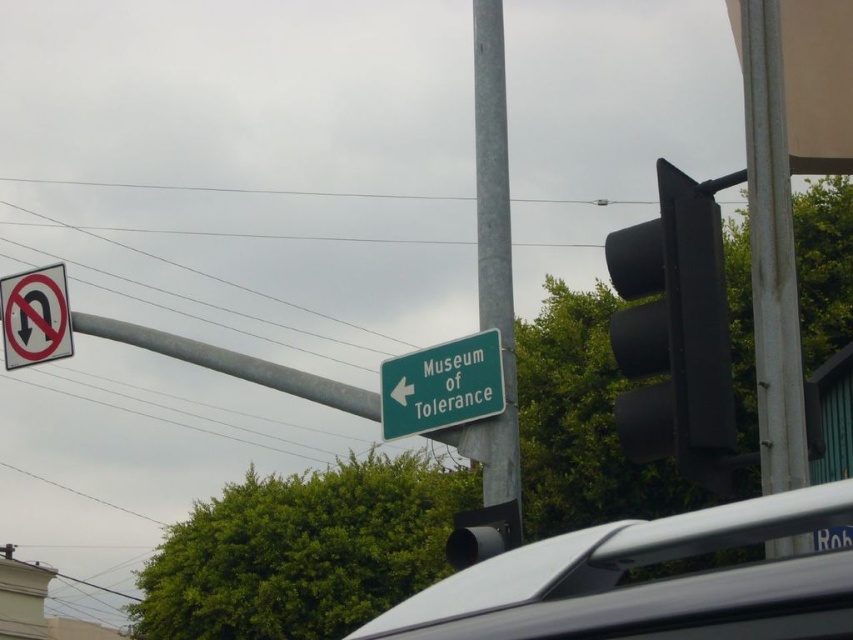
Is metallic pole at center to the left of green matte sign at center from the viewer's perspective?

In fact, metallic pole at center is to the right of green matte sign at center.

The width and height of the screenshot is (853, 640). What do you see at coordinates (495, 266) in the screenshot?
I see `metallic pole at center` at bounding box center [495, 266].

Where is `metallic pole at center`? This screenshot has width=853, height=640. metallic pole at center is located at coordinates (495, 266).

Who is more distant from viewer, (704, 420) or (498, 369)?

Positioned behind is point (498, 369).

What do you see at coordinates (674, 332) in the screenshot? This screenshot has width=853, height=640. I see `black matte traffic light at right` at bounding box center [674, 332].

Between point (695, 324) and point (410, 368), which one is positioned behind?

The point (410, 368) is behind.

The height and width of the screenshot is (640, 853). Find the location of `black matte traffic light at right`. black matte traffic light at right is located at coordinates (674, 332).

Is metallic gray pole at upper right closer to camera compared to green matte sign at center?

That is True.

Does point (764, 173) come farther from viewer compared to point (407, 355)?

No, (764, 173) is in front of (407, 355).

What do you see at coordinates (770, 248) in the screenshot?
I see `metallic gray pole at upper right` at bounding box center [770, 248].

The image size is (853, 640). Identify the location of metallic gray pole at upper right. (770, 248).